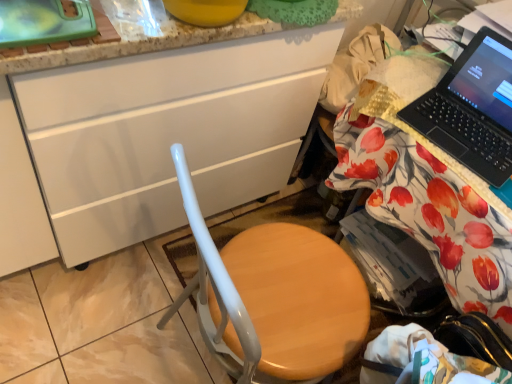
The width and height of the screenshot is (512, 384). What do you see at coordinates (472, 109) in the screenshot?
I see `black plastic laptop at upper right` at bounding box center [472, 109].

Locate an element on the screen. The width and height of the screenshot is (512, 384). black plastic laptop at upper right is located at coordinates (472, 109).

Is black plastic laptop at upper right taller or shorter than wooden desk at right?

black plastic laptop at upper right is shorter than wooden desk at right.

Is black plastic laptop at upper right positioned with its back to wooden desk at right?

black plastic laptop at upper right does not have its back to wooden desk at right.

Does black plastic laptop at upper right have a larger size compared to wooden desk at right?

No, black plastic laptop at upper right is not bigger than wooden desk at right.

Considering the sizes of objects black plastic laptop at upper right and wooden desk at right in the image provided, who is thinner, black plastic laptop at upper right or wooden desk at right?

black plastic laptop at upper right is thinner.

Considering the relative sizes of wooden desk at right and black plastic laptop at upper right in the image provided, is wooden desk at right smaller than black plastic laptop at upper right?

Incorrect, wooden desk at right is not smaller in size than black plastic laptop at upper right.

From the image's perspective, which is above, wooden desk at right or black plastic laptop at upper right?

black plastic laptop at upper right, from the image's perspective.

Is wooden desk at right oriented towards black plastic laptop at upper right?

No.

At what (x,y) coordinates should I click in order to perform the action: click on laptop on the left of wooden desk at right. Please return your answer as a coordinate pair (x, y). This screenshot has height=384, width=512. Looking at the image, I should click on (472, 109).

From a real-world perspective, which object stands above the other?

From a 3D spatial view, white glossy cabinet at center is above.

The width and height of the screenshot is (512, 384). In order to click on cabinetry above the wooden seat at center (from the image's perspective) in this screenshot , I will do `click(167, 133)`.

Is wooden seat at center taller or shorter than white glossy cabinet at center?

Considering their sizes, wooden seat at center has less height than white glossy cabinet at center.

Is wooden seat at center smaller than white glossy cabinet at center?

Yes.

Locate an element on the screen. desk behind the white glossy cabinet at center is located at coordinates (355, 65).

In the scene shown: From the image's perspective, is white glossy cabinet at center located beneath wooden desk at right?

No, from the image's perspective, white glossy cabinet at center is not beneath wooden desk at right.

Is white glossy cabinet at center shorter than wooden desk at right?

No, white glossy cabinet at center is not shorter than wooden desk at right.

What's the angular difference between white glossy cabinet at center and wooden desk at right's facing directions?

white glossy cabinet at center and wooden desk at right are facing 88 degrees away from each other.

Between black plastic laptop at upper right and wooden seat at center, which one is positioned in front?

wooden seat at center.

Can you confirm if black plastic laptop at upper right is smaller than wooden seat at center?

Yes, black plastic laptop at upper right is smaller than wooden seat at center.

Identify the location of chair below the black plastic laptop at upper right (from the image's perspective). Image resolution: width=512 pixels, height=384 pixels. (273, 298).

From the picture: Can you tell me how much white glossy cabinet at center and black plastic laptop at upper right differ in facing direction?

There is a 78.4-degree angle between the facing directions of white glossy cabinet at center and black plastic laptop at upper right.

Is black plastic laptop at upper right at the back of white glossy cabinet at center?

No, black plastic laptop at upper right is not at the back of white glossy cabinet at center.

Is white glossy cabinet at center smaller than black plastic laptop at upper right?

No.

Consider the image. Is white glossy cabinet at center wider or thinner than black plastic laptop at upper right?

white glossy cabinet at center is wider than black plastic laptop at upper right.

How many degrees apart are the facing directions of wooden seat at center and wooden desk at right?

wooden seat at center and wooden desk at right are facing 171 degrees away from each other.

Is wooden seat at center behind wooden desk at right?

No, wooden seat at center is closer to the viewer.

From a real-world perspective, which is physically above, wooden seat at center or wooden desk at right?

In real-world perspective, wooden seat at center is above.

Can you confirm if wooden seat at center is smaller than wooden desk at right?

Yes, wooden seat at center is smaller than wooden desk at right.

Find the location of a particular element. The height and width of the screenshot is (384, 512). laptop above the wooden desk at right (from a real-world perspective) is located at coordinates (472, 109).

At what (x,y) coordinates should I click in order to perform the action: click on desk below the black plastic laptop at upper right (from the image's perspective). Please return your answer as a coordinate pair (x, y). Looking at the image, I should click on (355, 65).

From the image, which object appears to be nearer to white glossy cabinet at center, black plastic laptop at upper right or wooden desk at right?

wooden desk at right is closer to white glossy cabinet at center.

From the image, which object appears to be nearer to wooden seat at center, wooden desk at right or black plastic laptop at upper right?

wooden desk at right is closer to wooden seat at center.

Based on their spatial positions, is black plastic laptop at upper right or wooden seat at center further from white glossy cabinet at center?

Among the two, black plastic laptop at upper right is located further to white glossy cabinet at center.

Estimate the real-world distances between objects in this image. Which object is further from wooden desk at right, white glossy cabinet at center or wooden seat at center?

Among the two, white glossy cabinet at center is located further to wooden desk at right.

From the image, which object appears to be farther from black plastic laptop at upper right, wooden seat at center or wooden desk at right?

wooden seat at center is positioned further to the anchor black plastic laptop at upper right.

Considering their positions, is black plastic laptop at upper right positioned closer to wooden seat at center than wooden desk at right?

wooden desk at right is closer to wooden seat at center.

Which object lies nearer to the anchor point wooden seat at center, white glossy cabinet at center or black plastic laptop at upper right?

white glossy cabinet at center lies closer to wooden seat at center than the other object.

Based on their spatial positions, is wooden seat at center or white glossy cabinet at center closer to wooden desk at right?

wooden seat at center lies closer to wooden desk at right than the other object.

The image size is (512, 384). What are the coordinates of `laptop between wooden seat at center and wooden desk at right` in the screenshot? It's located at (472, 109).

Identify the location of laptop between white glossy cabinet at center and wooden desk at right. Image resolution: width=512 pixels, height=384 pixels. (472, 109).

At what (x,y) coordinates should I click in order to perform the action: click on chair located between white glossy cabinet at center and black plastic laptop at upper right in the left-right direction. Please return your answer as a coordinate pair (x, y). The width and height of the screenshot is (512, 384). Looking at the image, I should click on (273, 298).

At what (x,y) coordinates should I click in order to perform the action: click on chair situated between white glossy cabinet at center and wooden desk at right from left to right. Please return your answer as a coordinate pair (x, y). The width and height of the screenshot is (512, 384). Looking at the image, I should click on (273, 298).